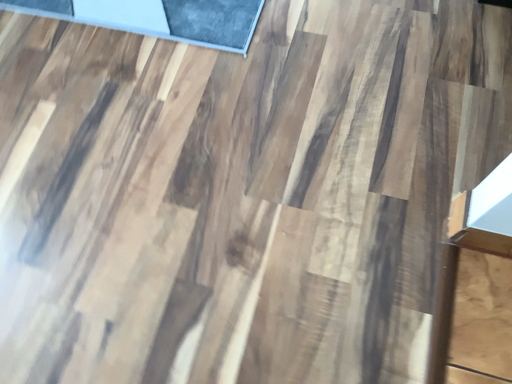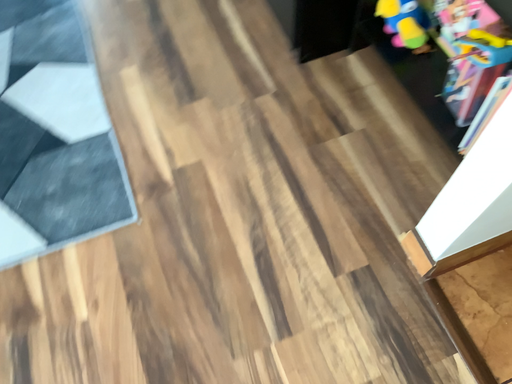
Question: Which way did the camera rotate in the video?

Choices:
 (A) rotated right
 (B) rotated left

Answer: (A)